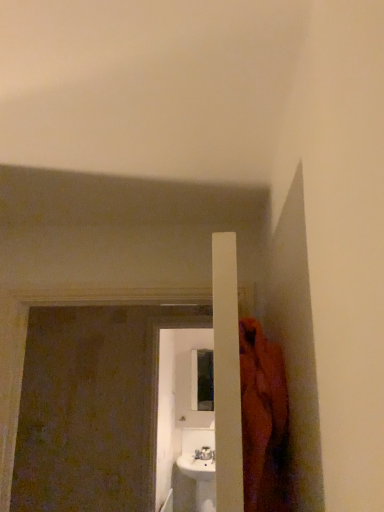
Find the location of `brown textured screen door at left, the first screen door when ordered from front to back`. brown textured screen door at left, the first screen door when ordered from front to back is located at coordinates (92, 407).

Image resolution: width=384 pixels, height=512 pixels. What do you see at coordinates (92, 407) in the screenshot? I see `brown textured screen door at left, the first screen door when ordered from front to back` at bounding box center [92, 407].

What is the approximate height of white glossy screen door at center, positioned as the first screen door in back-to-front order?

white glossy screen door at center, positioned as the first screen door in back-to-front order, is 1.17 meters in height.

This screenshot has height=512, width=384. Describe the element at coordinates (183, 421) in the screenshot. I see `white glossy screen door at center, positioned as the first screen door in back-to-front order` at that location.

Find the location of `white glossy screen door at center, positioned as the first screen door in back-to-front order`. white glossy screen door at center, positioned as the first screen door in back-to-front order is located at coordinates (183, 421).

Locate an element on the screen. This screenshot has width=384, height=512. brown textured screen door at left, the first screen door when ordered from front to back is located at coordinates (92, 407).

Visually, is brown textured screen door at left, the 2th screen door from the back, positioned to the left or to the right of white glossy screen door at center, positioned as the first screen door in back-to-front order?

brown textured screen door at left, the 2th screen door from the back, is to the left of white glossy screen door at center, positioned as the first screen door in back-to-front order.

Is brown textured screen door at left, the 2th screen door from the back, in front of white glossy screen door at center, positioned as the first screen door in back-to-front order?

Yes, it is.

Which point is more forward, (18, 456) or (189, 424)?

The point (18, 456) is in front.

From the image's perspective, is brown textured screen door at left, the first screen door when ordered from front to back, under white glossy screen door at center, placed as the 2th screen door when sorted from front to back?

No, from the image's perspective, brown textured screen door at left, the first screen door when ordered from front to back, is not below white glossy screen door at center, placed as the 2th screen door when sorted from front to back.

From a real-world perspective, between brown textured screen door at left, the 2th screen door from the back, and white glossy screen door at center, placed as the 2th screen door when sorted from front to back, who is vertically lower?

white glossy screen door at center, placed as the 2th screen door when sorted from front to back, is physically lower.

In terms of width, does brown textured screen door at left, the first screen door when ordered from front to back, look wider or thinner when compared to white glossy screen door at center, placed as the 2th screen door when sorted from front to back?

Clearly, brown textured screen door at left, the first screen door when ordered from front to back, has more width compared to white glossy screen door at center, placed as the 2th screen door when sorted from front to back.

Considering the relative sizes of brown textured screen door at left, the first screen door when ordered from front to back, and white glossy screen door at center, positioned as the first screen door in back-to-front order, in the image provided, is brown textured screen door at left, the first screen door when ordered from front to back, taller than white glossy screen door at center, positioned as the first screen door in back-to-front order,?

No, brown textured screen door at left, the first screen door when ordered from front to back, is not taller than white glossy screen door at center, positioned as the first screen door in back-to-front order.

Considering the sizes of brown textured screen door at left, the 2th screen door from the back, and white glossy screen door at center, positioned as the first screen door in back-to-front order, in the image, is brown textured screen door at left, the 2th screen door from the back, bigger or smaller than white glossy screen door at center, positioned as the first screen door in back-to-front order,?

brown textured screen door at left, the 2th screen door from the back, is bigger than white glossy screen door at center, positioned as the first screen door in back-to-front order.

Looking at this image, would you say brown textured screen door at left, the first screen door when ordered from front to back, is inside or outside white glossy screen door at center, placed as the 2th screen door when sorted from front to back?

brown textured screen door at left, the first screen door when ordered from front to back, lies outside white glossy screen door at center, placed as the 2th screen door when sorted from front to back.

Are brown textured screen door at left, the first screen door when ordered from front to back, and white glossy screen door at center, positioned as the first screen door in back-to-front order, beside each other?

No, brown textured screen door at left, the first screen door when ordered from front to back, is not touching white glossy screen door at center, positioned as the first screen door in back-to-front order.

Is brown textured screen door at left, the first screen door when ordered from front to back, facing towards white glossy screen door at center, positioned as the first screen door in back-to-front order?

No, brown textured screen door at left, the first screen door when ordered from front to back, is not aimed at white glossy screen door at center, positioned as the first screen door in back-to-front order.

The image size is (384, 512). What are the coordinates of `screen door above the white glossy screen door at center, placed as the 2th screen door when sorted from front to back (from the image's perspective)` in the screenshot? It's located at (92, 407).

Based on the photo, does white glossy screen door at center, positioned as the first screen door in back-to-front order, appear on the right side of brown textured screen door at left, the first screen door when ordered from front to back?

Yes, white glossy screen door at center, positioned as the first screen door in back-to-front order, is to the right of brown textured screen door at left, the first screen door when ordered from front to back.

Which object is further away from the camera, white glossy screen door at center, positioned as the first screen door in back-to-front order, or brown textured screen door at left, the first screen door when ordered from front to back?

white glossy screen door at center, positioned as the first screen door in back-to-front order.

Considering the points (181, 412) and (36, 510), which point is in front, point (181, 412) or point (36, 510)?

Positioned in front is point (36, 510).

From the image's perspective, between white glossy screen door at center, placed as the 2th screen door when sorted from front to back, and brown textured screen door at left, the 2th screen door from the back, who is located below?

From the image's view, white glossy screen door at center, placed as the 2th screen door when sorted from front to back, is below.

From a real-world perspective, between white glossy screen door at center, placed as the 2th screen door when sorted from front to back, and brown textured screen door at left, the 2th screen door from the back, who is vertically lower?

white glossy screen door at center, placed as the 2th screen door when sorted from front to back, is physically lower.

Considering the relative sizes of white glossy screen door at center, positioned as the first screen door in back-to-front order, and brown textured screen door at left, the first screen door when ordered from front to back, in the image provided, is white glossy screen door at center, positioned as the first screen door in back-to-front order, thinner than brown textured screen door at left, the first screen door when ordered from front to back,?

Yes.

Considering the sizes of white glossy screen door at center, positioned as the first screen door in back-to-front order, and brown textured screen door at left, the first screen door when ordered from front to back, in the image, is white glossy screen door at center, positioned as the first screen door in back-to-front order, taller or shorter than brown textured screen door at left, the first screen door when ordered from front to back,?

Clearly, white glossy screen door at center, positioned as the first screen door in back-to-front order, is taller compared to brown textured screen door at left, the first screen door when ordered from front to back.

Considering the sizes of objects white glossy screen door at center, positioned as the first screen door in back-to-front order, and brown textured screen door at left, the first screen door when ordered from front to back, in the image provided, who is bigger, white glossy screen door at center, positioned as the first screen door in back-to-front order, or brown textured screen door at left, the first screen door when ordered from front to back,?

brown textured screen door at left, the first screen door when ordered from front to back.

Is brown textured screen door at left, the first screen door when ordered from front to back, a part of white glossy screen door at center, positioned as the first screen door in back-to-front order?

Actually, brown textured screen door at left, the first screen door when ordered from front to back, is outside white glossy screen door at center, positioned as the first screen door in back-to-front order.

In the scene shown: Can you see white glossy screen door at center, placed as the 2th screen door when sorted from front to back, touching brown textured screen door at left, the 2th screen door from the back?

white glossy screen door at center, placed as the 2th screen door when sorted from front to back, is not next to brown textured screen door at left, the 2th screen door from the back, and they're not touching.

Is white glossy screen door at center, placed as the 2th screen door when sorted from front to back, facing away from brown textured screen door at left, the 2th screen door from the back?

That's not correct — white glossy screen door at center, placed as the 2th screen door when sorted from front to back, is not looking away from brown textured screen door at left, the 2th screen door from the back.

How different are the orientations of white glossy screen door at center, placed as the 2th screen door when sorted from front to back, and brown textured screen door at left, the 2th screen door from the back, in degrees?

The angle between the facing direction of white glossy screen door at center, placed as the 2th screen door when sorted from front to back, and the facing direction of brown textured screen door at left, the 2th screen door from the back, is 0.0308 degrees.

The image size is (384, 512). Identify the location of screen door on the left side of white glossy screen door at center, positioned as the first screen door in back-to-front order. (92, 407).

Identify the location of screen door above the white glossy screen door at center, placed as the 2th screen door when sorted from front to back (from the image's perspective). (92, 407).

At what (x,y) coordinates should I click in order to perform the action: click on screen door on the right side of brown textured screen door at left, the first screen door when ordered from front to back. Please return your answer as a coordinate pair (x, y). The image size is (384, 512). Looking at the image, I should click on (183, 421).